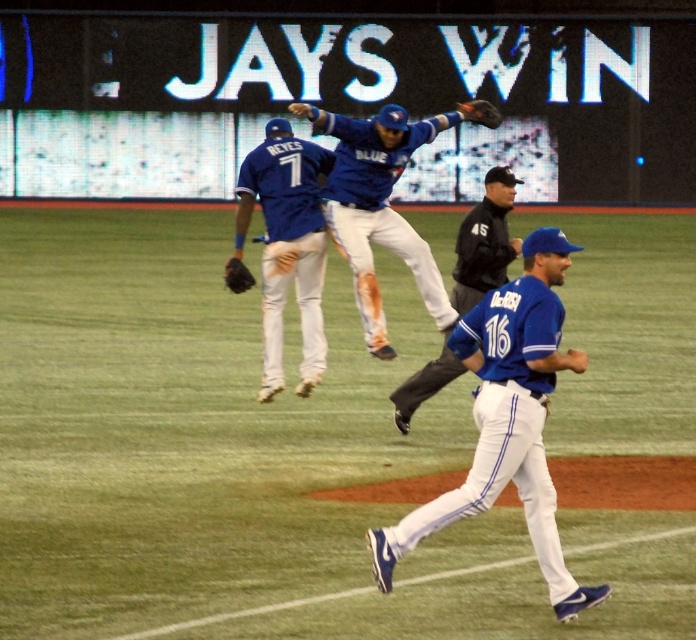
Between blue jersey at center and dark brown leather glove at upper center, which one is positioned higher?

dark brown leather glove at upper center is higher up.

Between point (381, 548) and point (470, 113), which one is positioned in front?

Positioned in front is point (381, 548).

Identify the location of blue jersey at center. (507, 419).

Is matte blue jersey at upper left smaller than black leather glove at center?

No.

Is matte blue jersey at upper left below black leather glove at center?

No.

Which is behind, point (271, 208) or point (235, 282)?

Positioned behind is point (271, 208).

Identify the location of matte blue jersey at upper left. (287, 244).

Is matte blue jersey at center further to camera compared to black leather glove at center?

That is False.

Is matte blue jersey at center taller than black leather glove at center?

Indeed, matte blue jersey at center has a greater height compared to black leather glove at center.

Measure the distance between matte blue jersey at center and camera.

matte blue jersey at center and camera are 11.87 meters apart.

Where is `matte blue jersey at center`? The height and width of the screenshot is (640, 696). matte blue jersey at center is located at coordinates (379, 205).